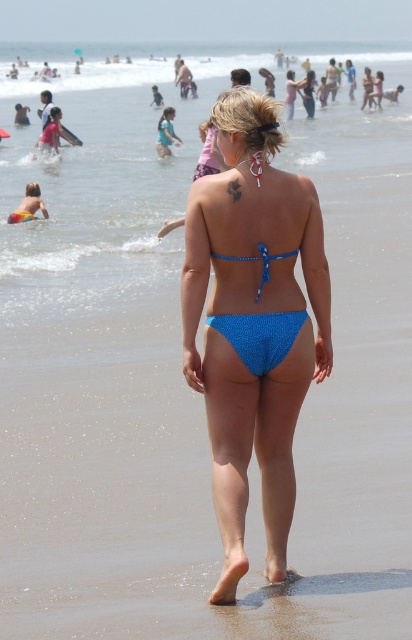
Question: Which point appears closest to the camera in this image?

Choices:
 (A) (164, 113)
 (B) (255, 417)

Answer: (B)

Question: Does matte pink swimsuit at upper left appear on the right side of light blue fabric bikini top at upper center?

Choices:
 (A) yes
 (B) no

Answer: (B)

Question: Which of the following is the closest to the observer?

Choices:
 (A) (170, 116)
 (B) (248, 225)
 (C) (264, 257)

Answer: (C)

Question: Is blue glittery bikini bottom at center closer to camera compared to matte pink swimsuit at upper left?

Choices:
 (A) yes
 (B) no

Answer: (A)

Question: Which of the following is the closest to the observer?

Choices:
 (A) matte pink swimsuit at upper left
 (B) blue fabric bikini at center

Answer: (B)

Question: Can you confirm if blue fabric bikini at center is thinner than light blue fabric bikini top at upper center?

Choices:
 (A) no
 (B) yes

Answer: (A)